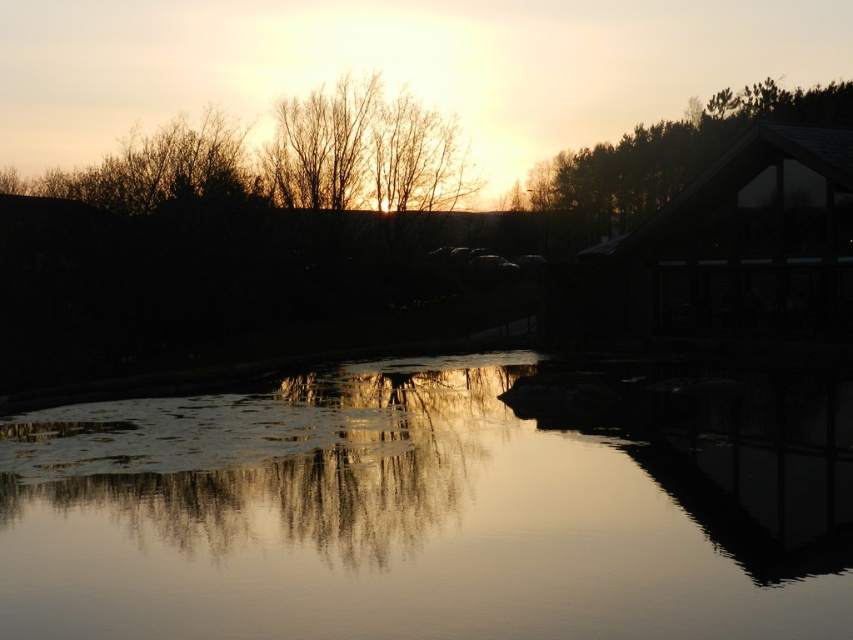
This screenshot has height=640, width=853. Identify the location of silvery reflective water at center. (364, 522).

Can you confirm if silvery reflective water at center is positioned above brown wooden hut at upper right?

Incorrect, silvery reflective water at center is not positioned above brown wooden hut at upper right.

Find the location of `silvery reflective water at center`. silvery reflective water at center is located at coordinates (364, 522).

Which is below, silvery reflective water at center or green matte roof at upper right?

Positioned lower is silvery reflective water at center.

Is silvery reflective water at center wider than green matte roof at upper right?

Incorrect, silvery reflective water at center's width does not surpass green matte roof at upper right's.

The width and height of the screenshot is (853, 640). Identify the location of silvery reflective water at center. (364, 522).

Is brown wooden hut at upper right below green matte roof at upper right?

Yes.

Who is more forward, (805, 145) or (598, 204)?

Positioned in front is point (805, 145).

Measure the distance between brown wooden hut at upper right and camera.

92.43 feet

In order to click on brown wooden hut at upper right in this screenshot , I will do `click(737, 246)`.